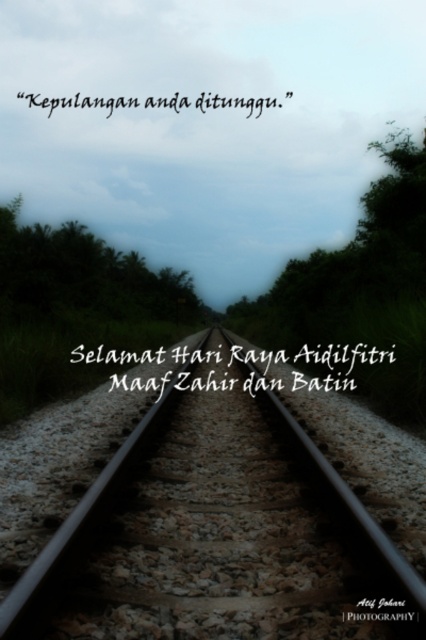
Can you confirm if smooth metal train track at center is smaller than black text at center?

Yes.

Is smooth metal train track at center thinner than black text at center?

Yes.

Who is more forward, (166, 465) or (40, 106)?

Point (166, 465)

The height and width of the screenshot is (640, 426). What are the coordinates of `smooth metal train track at center` in the screenshot? It's located at (204, 513).

Does black paper text at center lie in front of black text at center?

Yes, black paper text at center is in front of black text at center.

Which is more to the left, black paper text at center or black text at center?

Positioned to the left is black text at center.

Identify the location of black paper text at center. The width and height of the screenshot is (426, 640). (342, 362).

Does smooth metal train track at center have a lesser height compared to black matte text at upper center?

No.

Does smooth metal train track at center appear on the right side of black matte text at upper center?

No, smooth metal train track at center is not to the right of black matte text at upper center.

Is point (210, 611) farther from viewer compared to point (354, 618)?

Yes.

Locate an element on the screen. This screenshot has width=426, height=640. smooth metal train track at center is located at coordinates (204, 513).